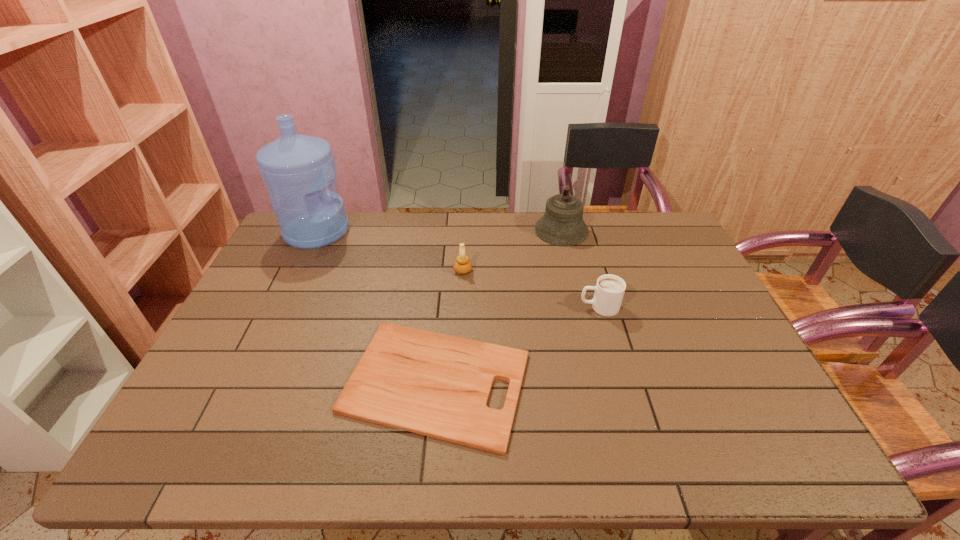
The width and height of the screenshot is (960, 540). I want to click on object present at the far left corner, so click(x=297, y=170).

Locate an element on the screen. Image resolution: width=960 pixels, height=540 pixels. vacant region at the far edge of the desktop is located at coordinates (525, 212).

Identify the location of free space at the left edge of the desktop. This screenshot has height=540, width=960. (243, 305).

In the image, there is a desktop. What are the coordinates of `vacant space at the right edge` in the screenshot? It's located at (737, 339).

What are the coordinates of `vacant position at the far right corner of the desktop` in the screenshot? It's located at (657, 217).

Find the location of a particular element. The width and height of the screenshot is (960, 540). vacant space at the near right corner of the desktop is located at coordinates (782, 454).

The width and height of the screenshot is (960, 540). What are the coordinates of `vacant space that is in between the third nearest object and the leftmost object` in the screenshot? It's located at (390, 251).

Identify the location of free space between the cappuccino and the chopping board. (517, 345).

The image size is (960, 540). What are the coordinates of `free space between the shortest object and the third nearest object` in the screenshot? It's located at tap(449, 326).

Where is `free area in between the nearest object and the bell`? This screenshot has width=960, height=540. free area in between the nearest object and the bell is located at coordinates coord(499,306).